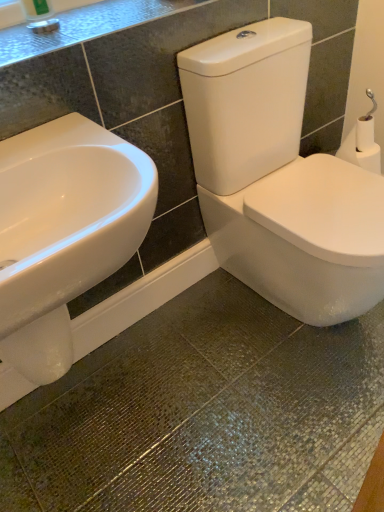
Question: Does white matte toilet paper at right come in front of white glossy sink at left?

Choices:
 (A) no
 (B) yes

Answer: (A)

Question: Can you confirm if white matte toilet paper at right is positioned to the right of white glossy sink at left?

Choices:
 (A) yes
 (B) no

Answer: (A)

Question: Is white matte toilet paper at right facing away from white glossy sink at left?

Choices:
 (A) no
 (B) yes

Answer: (A)

Question: Does white matte toilet paper at right have a larger size compared to white glossy sink at left?

Choices:
 (A) no
 (B) yes

Answer: (A)

Question: Can you confirm if white matte toilet paper at right is shorter than white glossy sink at left?

Choices:
 (A) yes
 (B) no

Answer: (A)

Question: Considering their positions, is granite countertop at upper left located in front of or behind white matte toilet paper at right?

Choices:
 (A) front
 (B) behind

Answer: (A)

Question: Looking at their shapes, would you say granite countertop at upper left is wider or thinner than white matte toilet paper at right?

Choices:
 (A) wide
 (B) thin

Answer: (A)

Question: Is granite countertop at upper left bigger or smaller than white matte toilet paper at right?

Choices:
 (A) big
 (B) small

Answer: (A)

Question: From their relative heights in the image, would you say granite countertop at upper left is taller or shorter than white matte toilet paper at right?

Choices:
 (A) tall
 (B) short

Answer: (B)

Question: From the image's perspective, relative to white glossy sink at left, is granite countertop at upper left above or below?

Choices:
 (A) above
 (B) below

Answer: (A)

Question: In terms of size, does granite countertop at upper left appear bigger or smaller than white glossy sink at left?

Choices:
 (A) big
 (B) small

Answer: (B)

Question: From a real-world perspective, is granite countertop at upper left physically located above or below white glossy sink at left?

Choices:
 (A) below
 (B) above

Answer: (B)

Question: Considering the relative positions of granite countertop at upper left and white glossy sink at left in the image provided, is granite countertop at upper left to the left or to the right of white glossy sink at left?

Choices:
 (A) left
 (B) right

Answer: (B)

Question: In terms of size, does white glossy sink at left appear bigger or smaller than white matte toilet paper at right?

Choices:
 (A) small
 (B) big

Answer: (B)

Question: In the image, is white glossy sink at left positioned in front of or behind white matte toilet paper at right?

Choices:
 (A) front
 (B) behind

Answer: (A)